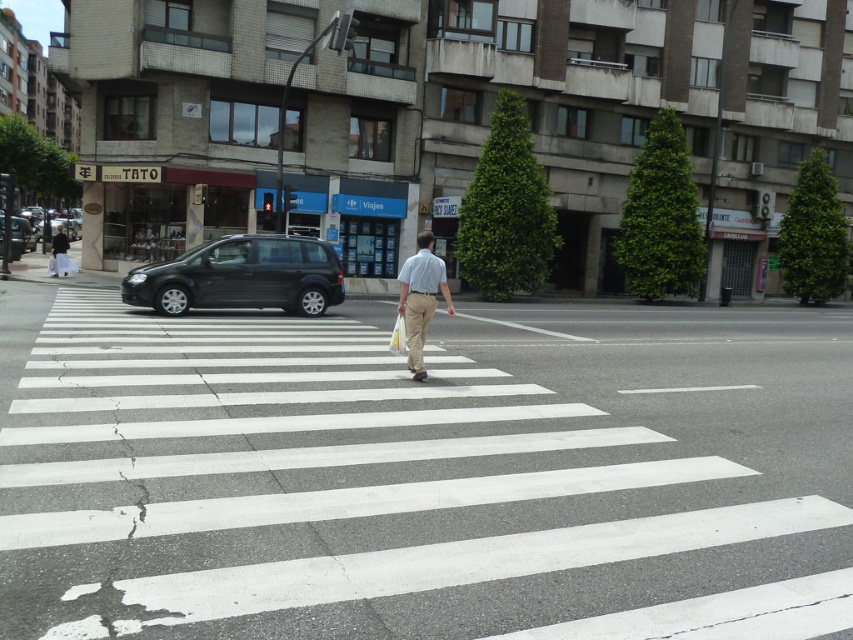
Question: Does khaki pants at center lie in front of light beige pants at left?

Choices:
 (A) no
 (B) yes

Answer: (B)

Question: Estimate the real-world distances between objects in this image. Which object is farther from the light beige pants at left?

Choices:
 (A) matte black car at left
 (B) khaki pants at center
 (C) black matte van at center
 (D) white asphalt crosswalk at center

Answer: (D)

Question: Based on their relative distances, which object is farther from the light beige pants at left?

Choices:
 (A) matte black car at left
 (B) white asphalt crosswalk at center
 (C) black matte van at center
 (D) khaki pants at center

Answer: (B)

Question: Which of the following is the closest to the observer?

Choices:
 (A) (61, 301)
 (B) (12, 234)
 (C) (422, 262)
 (D) (54, 272)

Answer: (C)

Question: Is black matte van at center bigger than matte black car at left?

Choices:
 (A) yes
 (B) no

Answer: (B)

Question: Does white asphalt crosswalk at center have a greater width compared to black matte van at center?

Choices:
 (A) no
 (B) yes

Answer: (B)